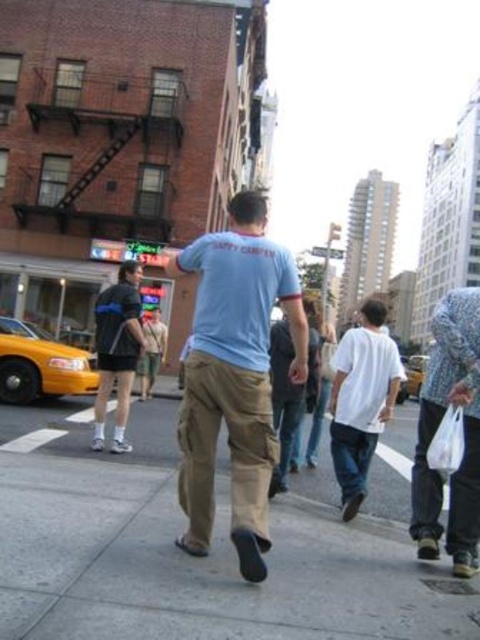
You are a fashion designer observing a street scene and notice two outfits. The first is a white cotton shirt at center, and the second is dark gray fabric shorts at left. Which outfit has a larger size?

The white cotton shirt at center has a larger size compared to the dark gray fabric shorts at left.